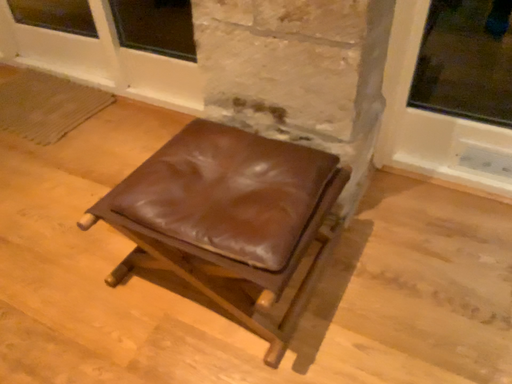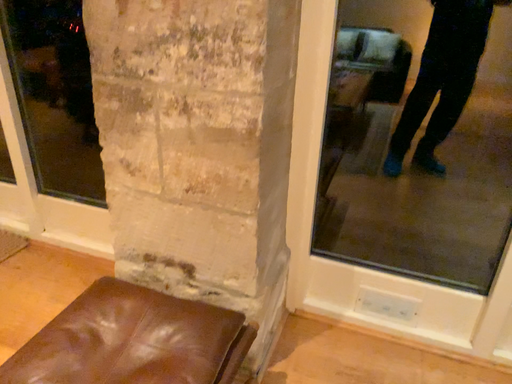
Question: Which way did the camera rotate in the video?

Choices:
 (A) rotated upward
 (B) rotated downward

Answer: (A)